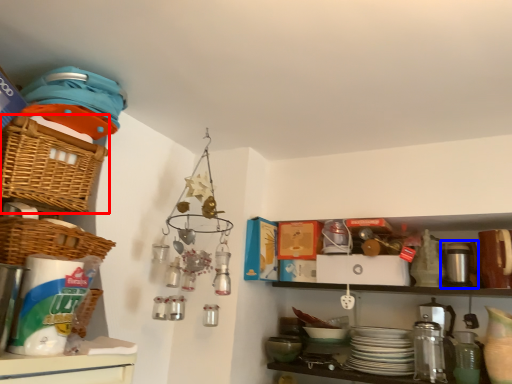
Question: Which object appears closest to the camera in this image, basket (highlighted by a red box) or appliance (highlighted by a blue box)?

Choices:
 (A) basket
 (B) appliance

Answer: (A)